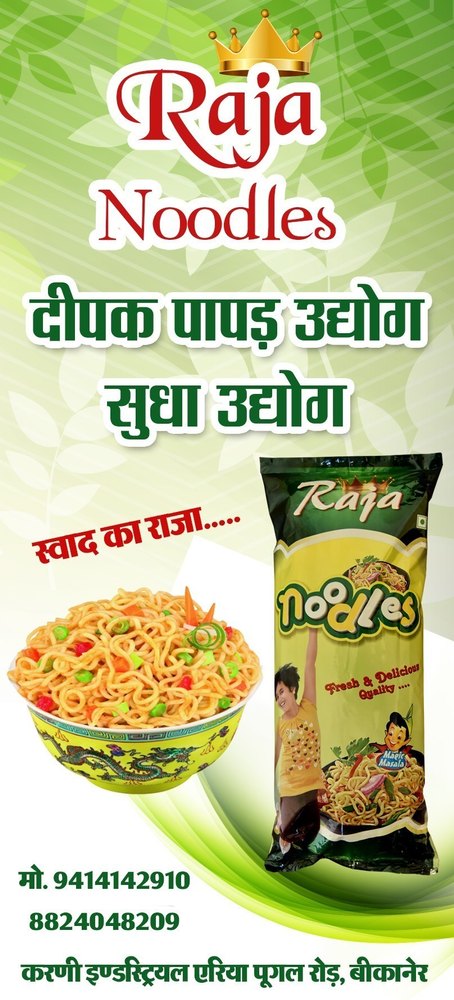
You are a GUI agent. You are given a task and a screenshot of the screen. Output one action in this format:
    pyautogui.click(x=<x>, y=<y>)
    Task: Click on the bowl of noodles
    
    Given the screenshot: What is the action you would take?
    pyautogui.click(x=369, y=764), pyautogui.click(x=153, y=710), pyautogui.click(x=383, y=569)